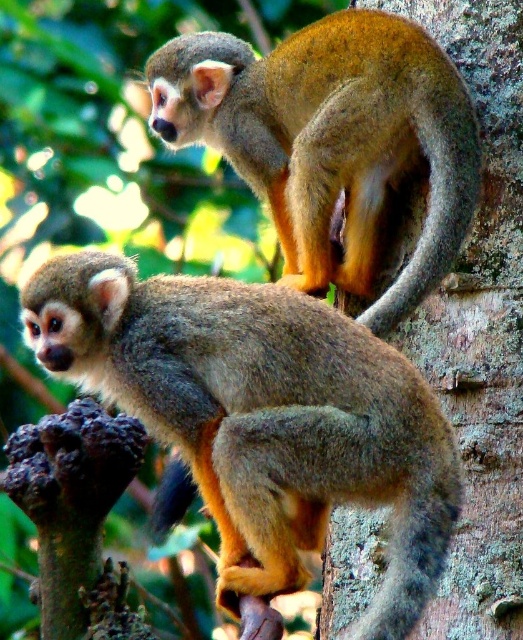
Question: Which point appears closest to the camera in this image?

Choices:
 (A) (401, 68)
 (B) (247, 406)

Answer: (B)

Question: Which object is farther from the camera taking this photo?

Choices:
 (A) brown furry monkey at lower left
 (B) golden fur monkey at upper center

Answer: (B)

Question: Is brown furry monkey at lower left positioned behind golden fur monkey at upper center?

Choices:
 (A) no
 (B) yes

Answer: (A)

Question: Does brown furry monkey at lower left appear on the right side of golden fur monkey at upper center?

Choices:
 (A) yes
 (B) no

Answer: (B)

Question: Can you confirm if brown furry monkey at lower left is smaller than golden fur monkey at upper center?

Choices:
 (A) no
 (B) yes

Answer: (B)

Question: Which point is closer to the camera?

Choices:
 (A) brown furry monkey at lower left
 (B) golden fur monkey at upper center

Answer: (A)